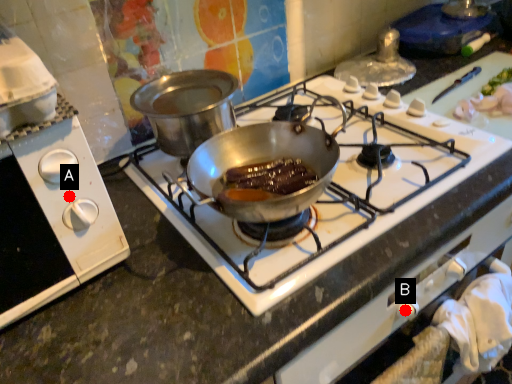
Question: Two points are circled on the image, labeled by A and B beside each circle. Which point is closer to the camera taking this photo?

Choices:
 (A) A is closer
 (B) B is closer

Answer: (A)